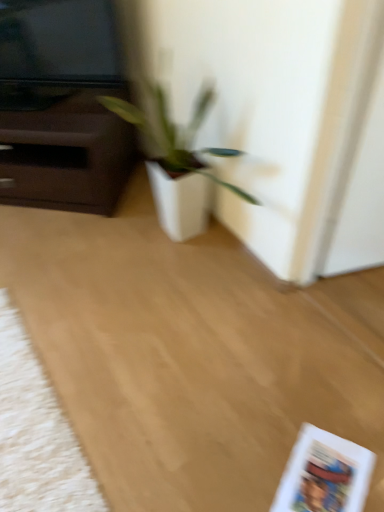
Locate an element on the screen. free space to the back side of white matte paperback book at lower right is located at coordinates (305, 408).